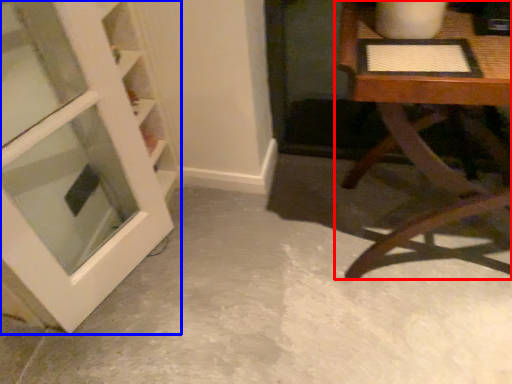
Question: Among these objects, which one is farthest to the camera, table (highlighted by a red box) or door (highlighted by a blue box)?

Choices:
 (A) table
 (B) door

Answer: (A)